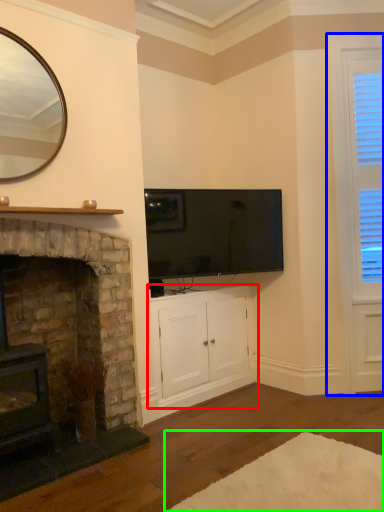
Question: Considering the real-world distances, which object is closest to cabinetry (highlighted by a red box)? window frame (highlighted by a blue box) or plain (highlighted by a green box).

Choices:
 (A) window frame
 (B) plain

Answer: (B)